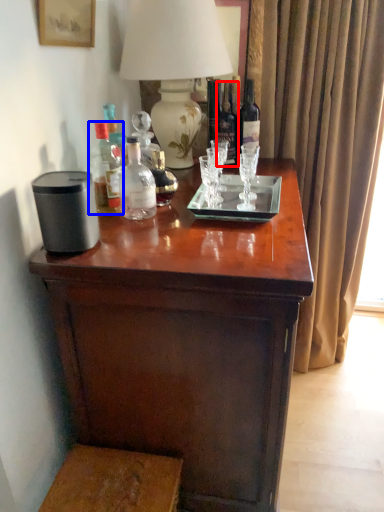
Question: Which of the following is the closest to the observer, bottle (highlighted by a red box) or bottle (highlighted by a blue box)?

Choices:
 (A) bottle
 (B) bottle

Answer: (B)